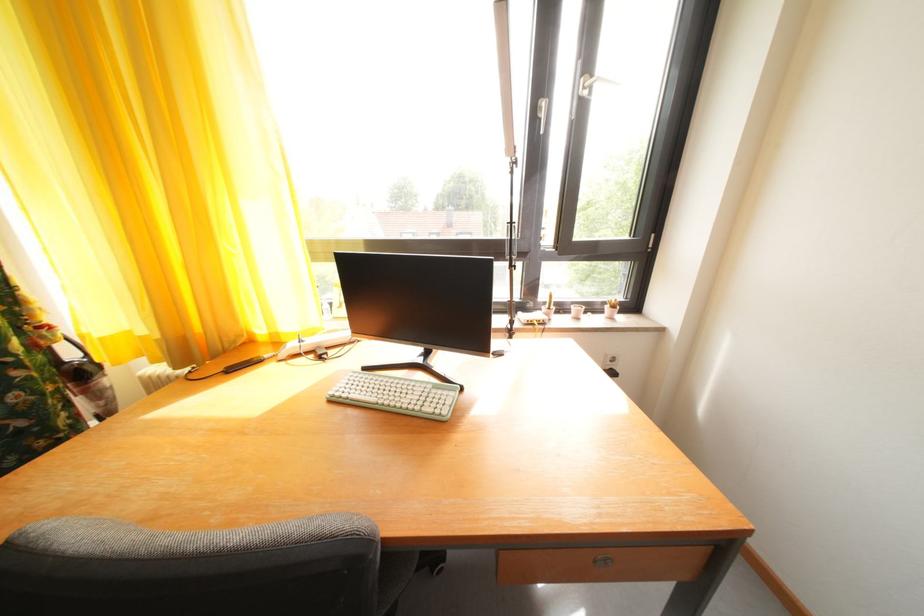
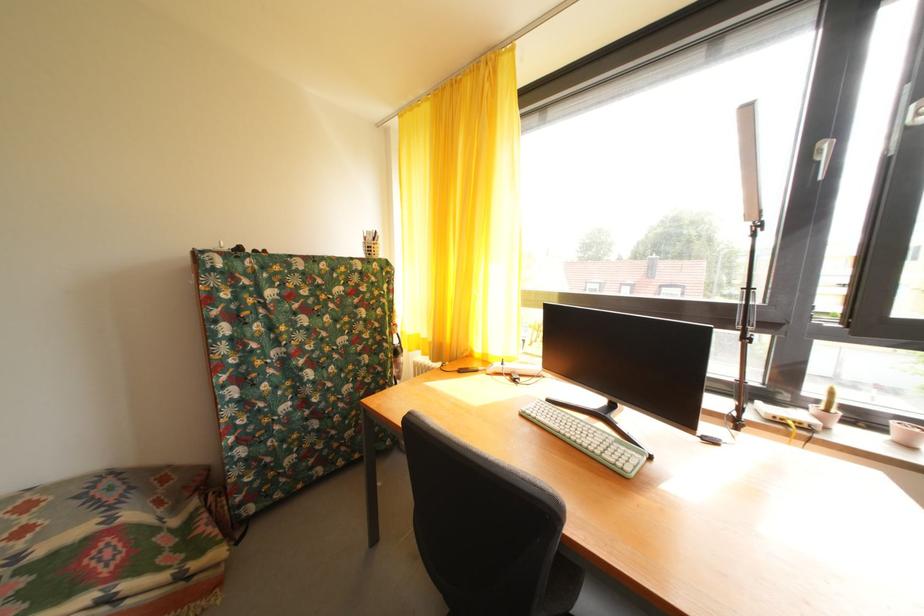
In the second image, find the point that corresponds to (558,315) in the first image.

(836, 416)